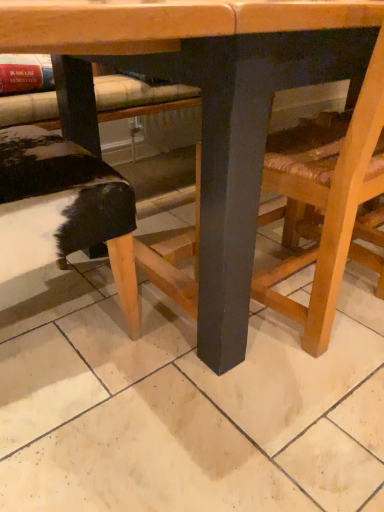
Image resolution: width=384 pixels, height=512 pixels. What do you see at coordinates (221, 135) in the screenshot? I see `wooden table at center` at bounding box center [221, 135].

Find the location of `black furry cushion at lower left`. black furry cushion at lower left is located at coordinates (64, 210).

Could you tell me if wooden chair at lower right is turned towards wooden table at center?

Yes, wooden chair at lower right is facing wooden table at center.

Considering the positions of points (363, 117) and (126, 244), is point (363, 117) farther from camera compared to point (126, 244)?

No, it is in front of (126, 244).

Considering the relative sizes of wooden chair at lower right and wooden table at center in the image provided, is wooden chair at lower right bigger than wooden table at center?

Actually, wooden chair at lower right might be smaller than wooden table at center.

From a real-world perspective, relative to wooden table at center, is wooden chair at lower right vertically above or below?

wooden chair at lower right is above wooden table at center.

Is black furry cushion at lower left wider or thinner than wooden table at center?

black furry cushion at lower left is thinner than wooden table at center.

Are black furry cushion at lower left and wooden table at center far apart?

No, there isn't a large distance between black furry cushion at lower left and wooden table at center.

How different are the orientations of black furry cushion at lower left and wooden table at center in degrees?

89.5 degrees separate the facing orientations of black furry cushion at lower left and wooden table at center.

Considering the sizes of wooden chair at lower right and black furry cushion at lower left in the image, is wooden chair at lower right bigger or smaller than black furry cushion at lower left?

In the image, wooden chair at lower right appears to be larger than black furry cushion at lower left.

Is wooden chair at lower right situated inside black furry cushion at lower left or outside?

wooden chair at lower right is located beyond the bounds of black furry cushion at lower left.

What's the angular difference between wooden chair at lower right and black furry cushion at lower left's facing directions?

The angular difference between wooden chair at lower right and black furry cushion at lower left is 87.8 degrees.

Is wooden chair at lower right not near black furry cushion at lower left?

That's not correct — wooden chair at lower right is a little close to black furry cushion at lower left.

Are black furry cushion at lower left and wooden chair at lower right making contact?

There is a gap between black furry cushion at lower left and wooden chair at lower right.

Is black furry cushion at lower left facing towards wooden chair at lower right?

Yes.

Considering the relative sizes of black furry cushion at lower left and wooden chair at lower right in the image provided, is black furry cushion at lower left smaller than wooden chair at lower right?

Yes.

From a real-world perspective, which is physically below, black furry cushion at lower left or wooden chair at lower right?

In real-world perspective, black furry cushion at lower left is lower.

Is wooden table at center situated inside wooden chair at lower right or outside?

The correct answer is: outside.

From a real-world perspective, which object stands above the other?

In real-world perspective, wooden chair at lower right is above.

Which object is thinner, wooden table at center or wooden chair at lower right?

wooden chair at lower right.

From their relative heights in the image, would you say wooden table at center is taller or shorter than wooden chair at lower right?

In the image, wooden table at center appears to be taller than wooden chair at lower right.

From the picture: Is wooden table at center wider than black furry cushion at lower left?

Yes.

Who is taller, wooden table at center or black furry cushion at lower left?

With more height is wooden table at center.

Is wooden table at center positioned beyond the bounds of black furry cushion at lower left?

Indeed, wooden table at center is completely outside black furry cushion at lower left.

At what (x,y) coordinates should I click in order to perform the action: click on table in front of the black furry cushion at lower left. Please return your answer as a coordinate pair (x, y). This screenshot has width=384, height=512. Looking at the image, I should click on (221, 135).

The width and height of the screenshot is (384, 512). In order to click on chair located on the left of wooden table at center in this screenshot , I will do `click(334, 218)`.

Where is `park bench that is under the wooden table at center (from a real-world perspective)`? park bench that is under the wooden table at center (from a real-world perspective) is located at coordinates (64, 210).

From the image, which object appears to be nearer to wooden table at center, black furry cushion at lower left or wooden chair at lower right?

The object closer to wooden table at center is wooden chair at lower right.

Based on their spatial positions, is wooden chair at lower right or black furry cushion at lower left further from wooden table at center?

Among the two, black furry cushion at lower left is located further to wooden table at center.

When comparing their distances from wooden chair at lower right, does black furry cushion at lower left or wooden table at center seem closer?

wooden table at center lies closer to wooden chair at lower right than the other object.

Looking at the image, which one is located closer to black furry cushion at lower left, wooden chair at lower right or wooden table at center?

wooden table at center is closer to black furry cushion at lower left.

Which object lies further to the anchor point wooden chair at lower right, wooden table at center or black furry cushion at lower left?

black furry cushion at lower left.

Considering their positions, is wooden table at center positioned closer to black furry cushion at lower left than wooden chair at lower right?

Based on the image, wooden table at center appears to be nearer to black furry cushion at lower left.

Where is `chair situated between black furry cushion at lower left and wooden table at center from left to right`? chair situated between black furry cushion at lower left and wooden table at center from left to right is located at coordinates (334, 218).